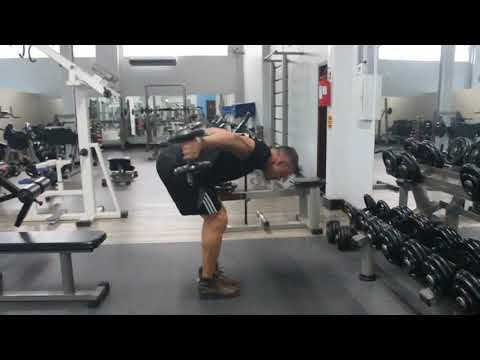
Where is `fire extinguisher`? fire extinguisher is located at coordinates (327, 96).